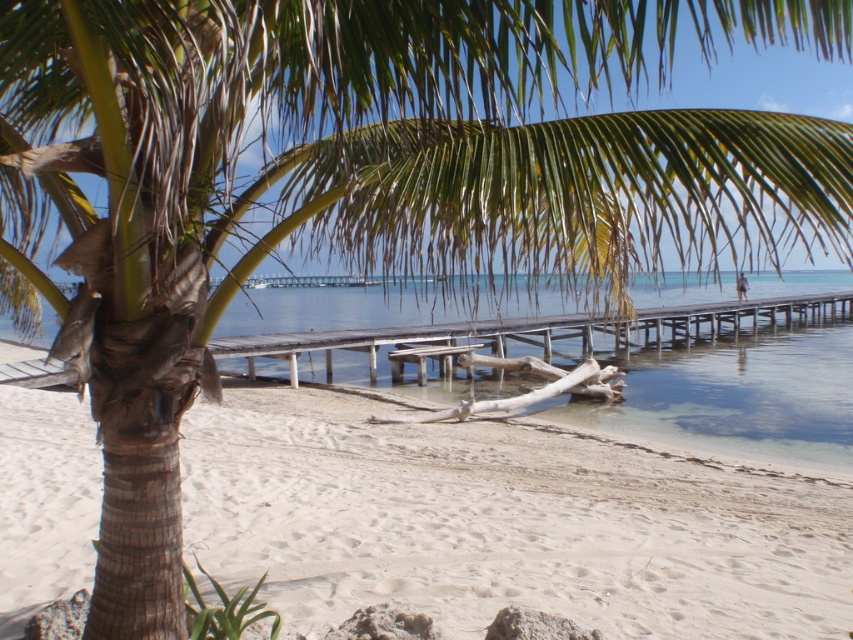
Looking at this image, you are standing on the white sandy beach at lower left and want to reach the clear blue water at center. Which direction should you walk to get there?

You should walk forward towards the clear blue water at center because it is located behind the white sandy beach at lower left.

You are standing on the white sandy beach at lower left and want to reach the clear blue water at center. Which direction should you walk to get there?

You should walk to the right because the white sandy beach at lower left is to the left of clear blue water at center, so moving right will take you towards the water.

You are standing at the edge of the white sandy beach at lower left and want to walk to the clear blue water at center. How does the width of the beach compare to the width of the water in this scene?

The white sandy beach at lower left is narrower than the clear blue water at center because its width is less than the water.